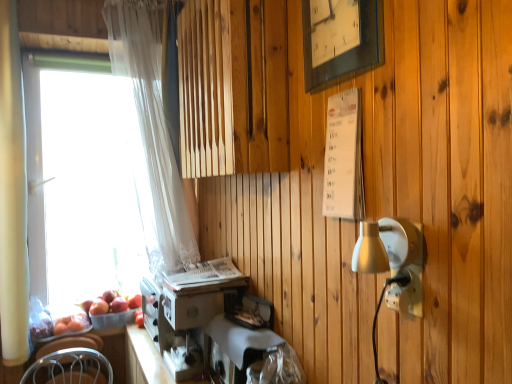
You are a GUI agent. You are given a task and a screenshot of the screen. Output one action in this format:
    pyautogui.click(x=<x>, y=<y>)
    Task: Click on the free space above translucent plastic basket at lower left (from a real-world perspective)
    The width and height of the screenshot is (512, 384).
    Given the screenshot: What is the action you would take?
    pyautogui.click(x=114, y=312)